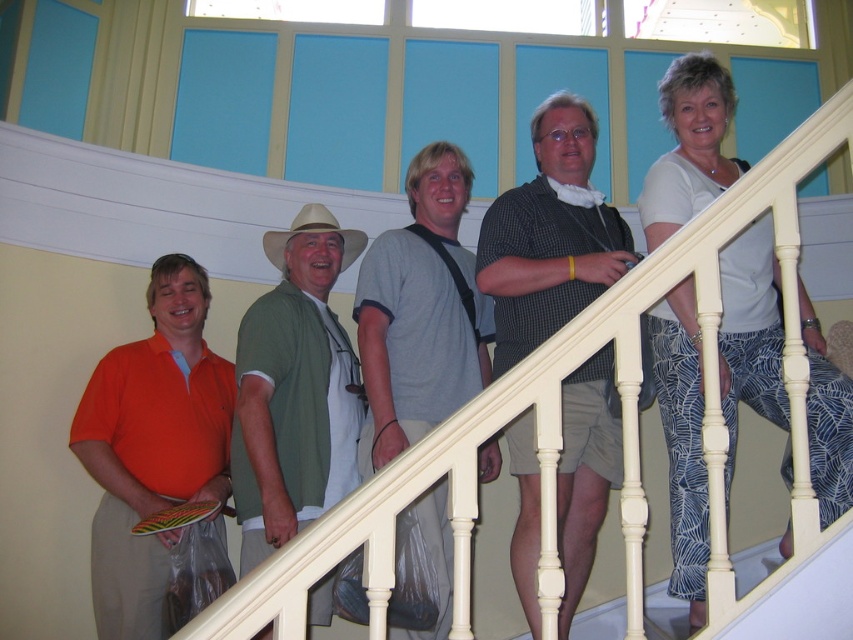
You are a photographer trying to capture a group photo of the checkered shirt at center and the green fabric shirt at center. Which one should you focus on first if you want to ensure both are in focus?

The checkered shirt at center is much taller than the green fabric shirt at center, so focusing on the checkered shirt at center first would ensure both are in focus as the taller object is further away.

In the scene shown: You are an interior designer assessing the space in the image. You need to place a decorative item that is 1 meter wide between the white painted wood at upper center and the tan straw cowboy hat at center. Considering their widths, will the space between them accommodate this item?

The white painted wood at upper center has a lesser width compared to tan straw cowboy hat at center. Since the decorative item is 1 meter wide, you need to ensure the space between them is at least 1 meter. However, without knowing the exact distance between the two objects, we can only confirm their relative widths, not the spacing. Thus, it is uncertain if the space is sufficient.

You are an interior designer assessing the space for a new sculpture. The sculpture will be placed between the white painted wood at upper center and the tan straw cowboy hat at center. Which object should the sculpture be placed closer to if it needs to be near the smaller one?

The sculpture should be placed closer to the white painted wood at upper center because it is smaller than the tan straw cowboy hat at center.